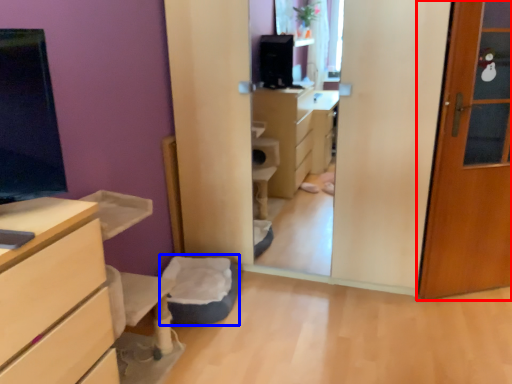
Question: Which point is further to the camera, door (highlighted by a red box) or flat (highlighted by a blue box)?

Choices:
 (A) door
 (B) flat

Answer: (B)